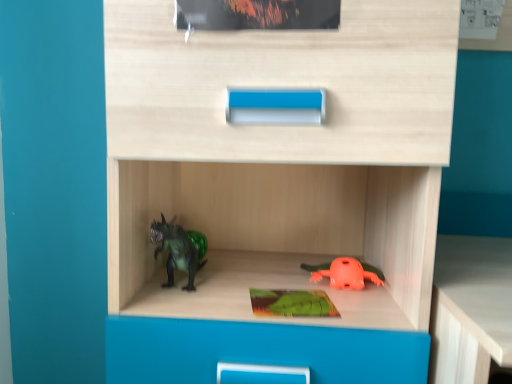
Question: From the image's perspective, is orange matte frog at lower center, placed as the first toy when sorted from right to left, above or below green matte dinosaur at left, positioned as the second toy in right-to-left order?

Choices:
 (A) above
 (B) below

Answer: (B)

Question: Considering the relative positions of orange matte frog at lower center, placed as the 2th toy when sorted from left to right, and green matte dinosaur at left, acting as the first toy starting from the left, in the image provided, is orange matte frog at lower center, placed as the 2th toy when sorted from left to right, to the left or to the right of green matte dinosaur at left, acting as the first toy starting from the left,?

Choices:
 (A) right
 (B) left

Answer: (A)

Question: Estimate the real-world distances between objects in this image. Which object is farther from the green matte dinosaur at left, acting as the first toy starting from the left?

Choices:
 (A) orange matte frog at lower center, placed as the first toy when sorted from right to left
 (B) green matte paperback book at center

Answer: (A)

Question: Considering the real-world distances, which object is closest to the green matte dinosaur at left, acting as the first toy starting from the left?

Choices:
 (A) orange matte frog at lower center, placed as the 2th toy when sorted from left to right
 (B) green matte paperback book at center

Answer: (B)